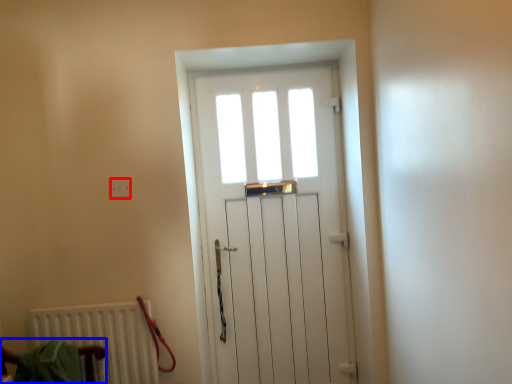
Question: Among these objects, which one is nearest to the camera, electric outlet (highlighted by a red box) or armchair (highlighted by a blue box)?

Choices:
 (A) electric outlet
 (B) armchair

Answer: (B)